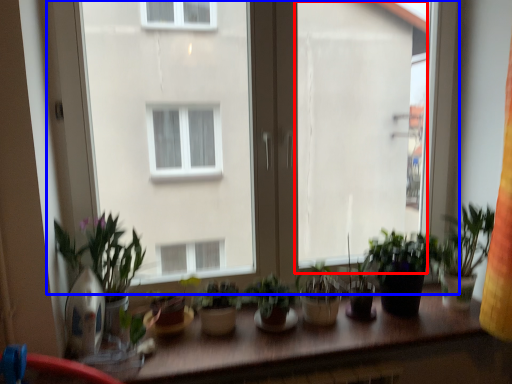
Question: Among these objects, which one is nearest to the camera, window screen (highlighted by a red box) or window (highlighted by a blue box)?

Choices:
 (A) window screen
 (B) window

Answer: (B)